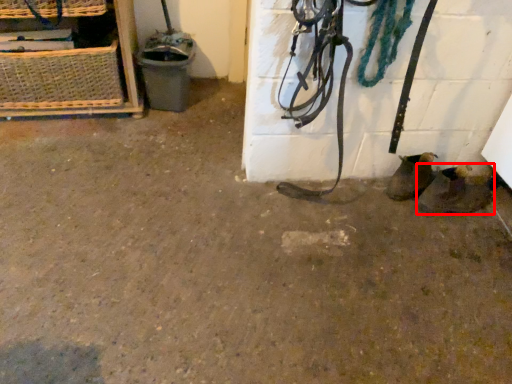
Question: From the image's perspective, what is the correct spatial positioning of footwear (annotated by the red box) in reference to basket?

Choices:
 (A) above
 (B) below

Answer: (B)